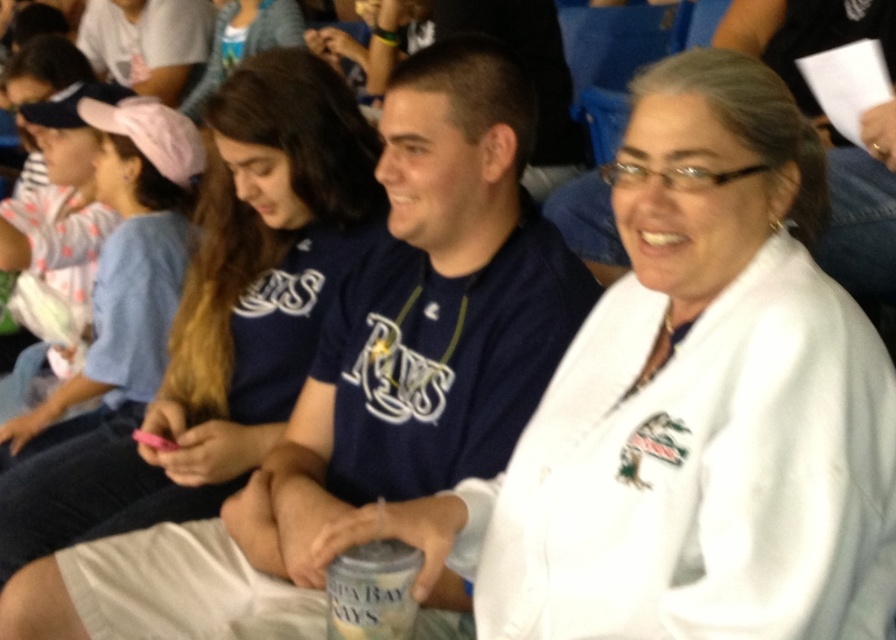
You are attending a baseball game and notice two items in the crowd. There is a white fleece robe at center and a pink fabric cap at upper left. From your seat, which item appears closer to the front of the arena?

The pink fabric cap at upper left appears closer to the front of the arena because the white fleece robe at center is positioned below it, indicating it is further back.

You are standing in the stadium and want to take a photo of the point at coordinates point (356, 225). If your camera has a focal length of 50mm and you are 1.78 meters away from the point, will you need to adjust your camera settings for close focusing?

The distance between you and the point (356, 225) is 1.78 meters. Most standard cameras have a minimum focusing distance greater than 1 meter, so you may need to adjust your camera settings for close focusing to capture the point clearly.